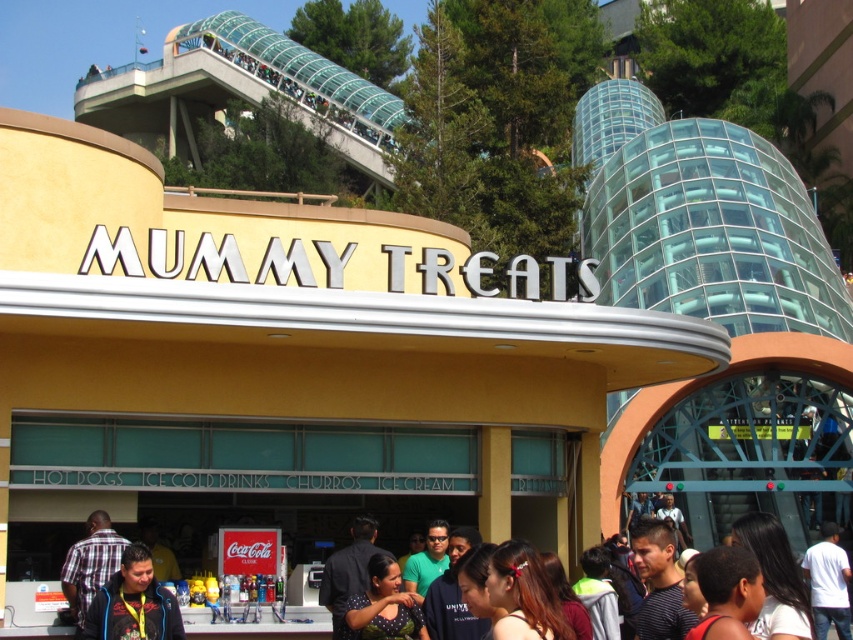
You are standing at the entrance of the MUMMY TREATS building and want to reach the exit located at point [126,637]. There is an obstacle at point [827,588]. Can you safely walk around the obstacle to reach the exit?

Point [827,588] is behind point [126,637], so the obstacle is behind the exit. Therefore, you can safely walk towards the exit at point [126,637] without needing to go around the obstacle since it is not blocking your path.

You are a visitor at the theme park and want to buy an ice cream from MUMMY TREATS. You notice a person with dark brown hair at center and a person in dark blue jacket at lower left. Which person is closer to the entrance of the building?

The dark brown hair at center is closer to the entrance because it is in front of the dark blue jacket at lower left, indicating they are nearer to the building.

You are standing in front of the MUMMY TREATS building and looking at the crowd. Where exactly is the person with dark brown hair at center located in terms of coordinates?

The dark brown hair at center is located at point [793,577].